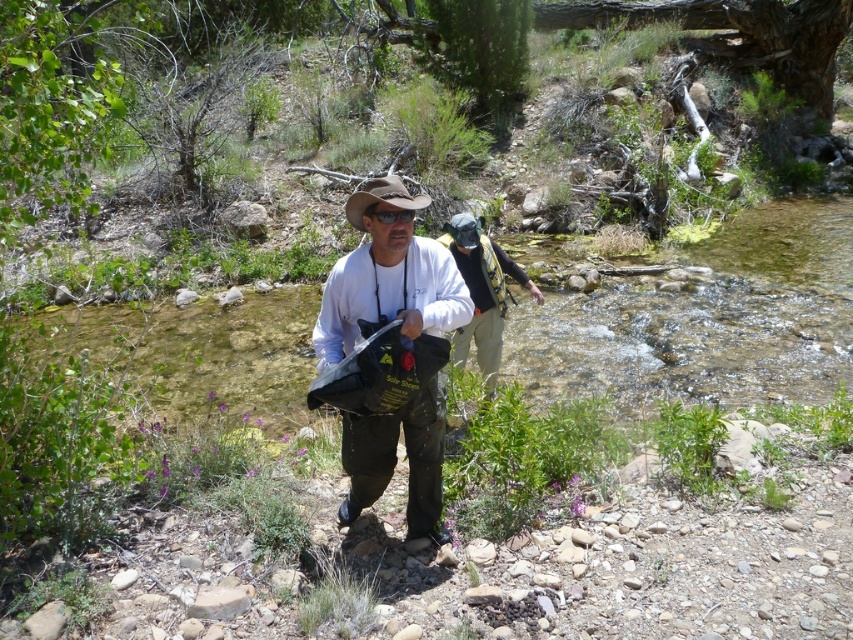
Question: Which of the following is the farthest from the observer?

Choices:
 (A) (473, 278)
 (B) (335, 312)
 (C) (361, 228)

Answer: (A)

Question: From the image, what is the correct spatial relationship of matte black bag at center in relation to brown leather cowboy hat at center?

Choices:
 (A) right
 (B) left

Answer: (A)

Question: Can you confirm if matte black bag at center is bigger than matte black backpack at center?

Choices:
 (A) no
 (B) yes

Answer: (A)

Question: Can you confirm if matte black bag at center is smaller than brown leather cowboy hat at center?

Choices:
 (A) yes
 (B) no

Answer: (A)

Question: Which of the following is the closest to the observer?

Choices:
 (A) (368, 182)
 (B) (462, 221)
 (C) (422, 205)

Answer: (A)

Question: Which point appears closest to the camera in this image?

Choices:
 (A) 416,417
 (B) 459,236
 (C) 393,196

Answer: (C)